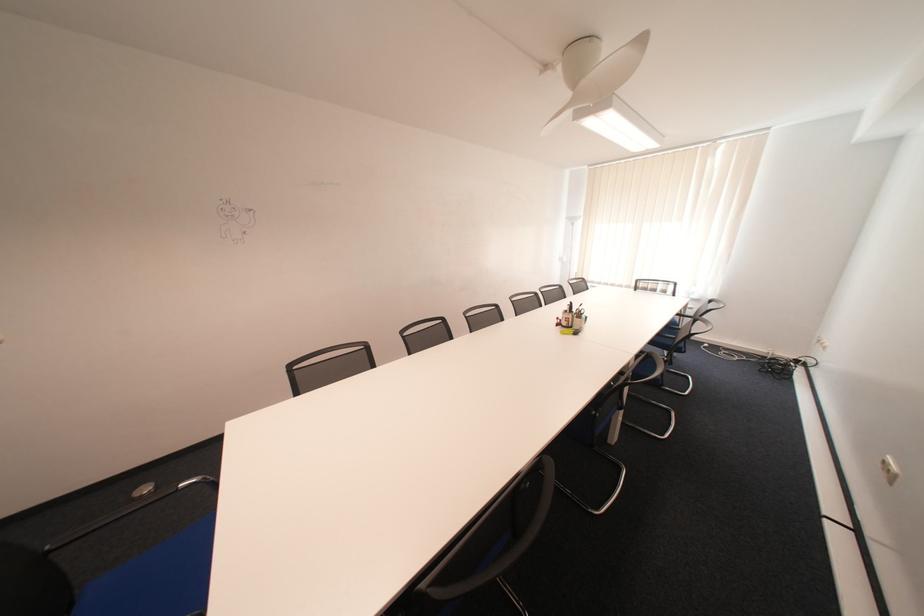
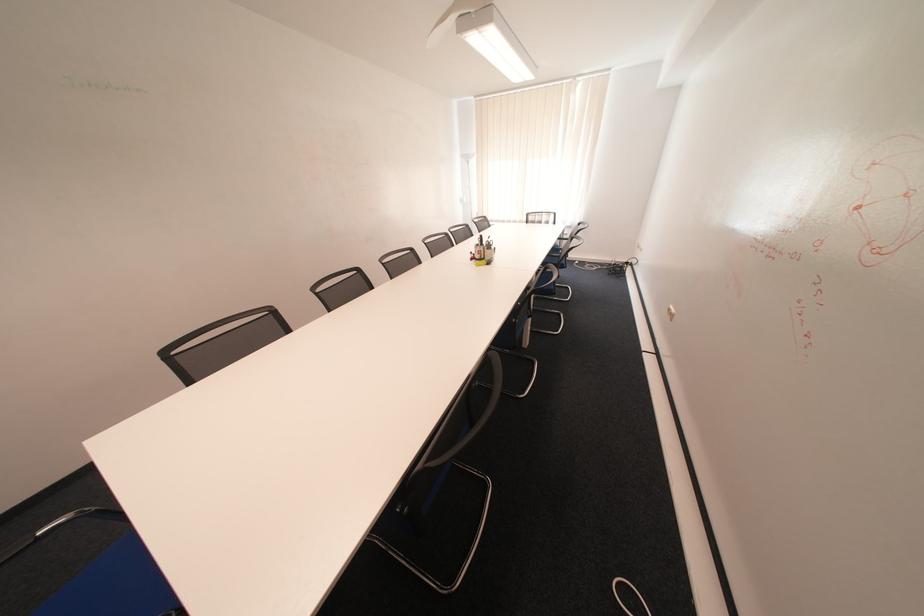
Question: In a continuous first-person perspective shot, in which direction is the camera moving?

Choices:
 (A) Left
 (B) Right
 (C) Forward
 (D) Backward

Answer: (A)